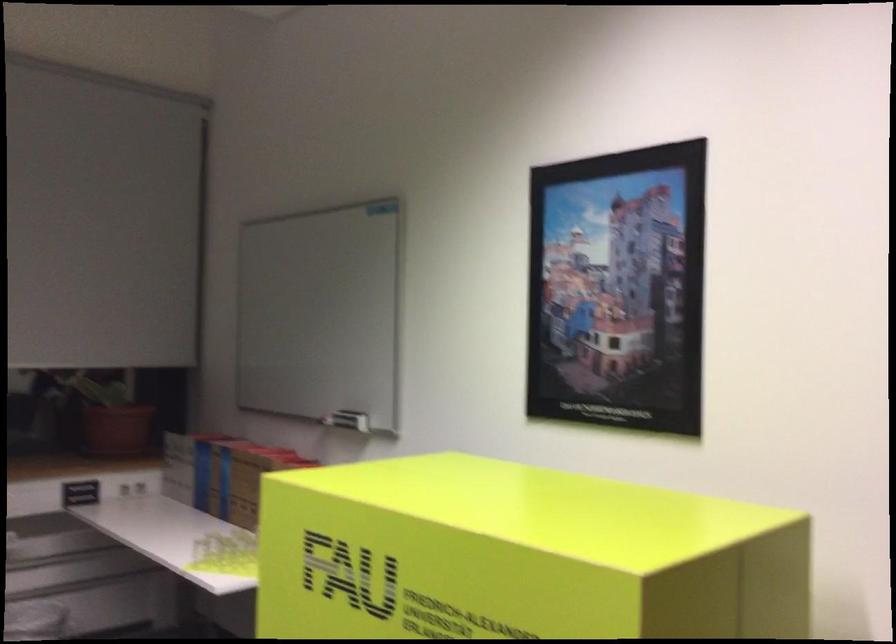
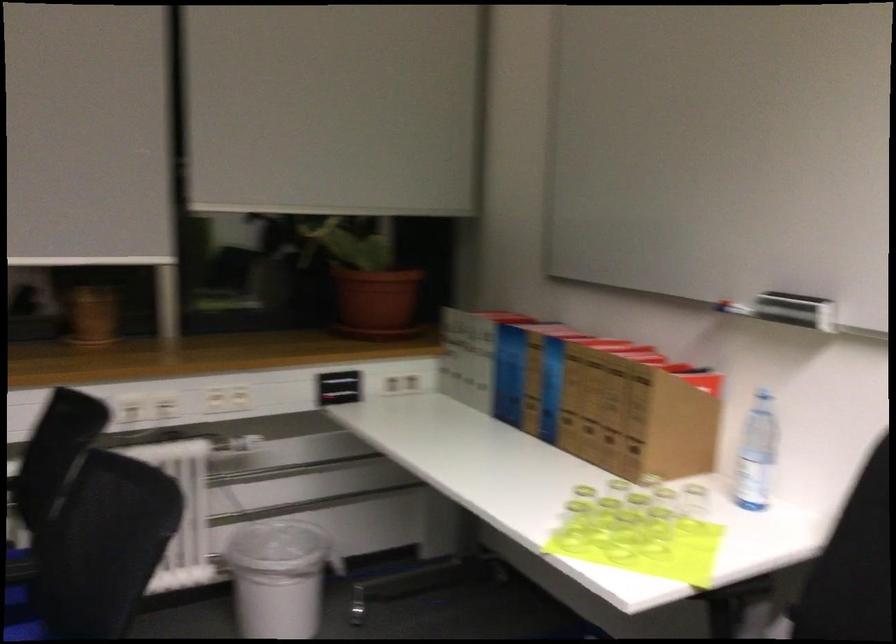
The images are taken continuously from a first-person perspective. In which direction are you moving?

The cameraman moved toward left, forward.